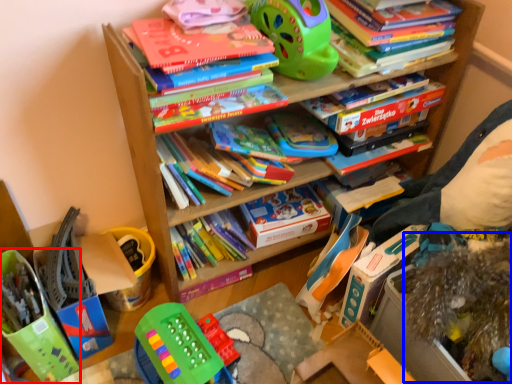
Question: Among these objects, which one is nearest to the camera, toy (highlighted by a red box) or toy (highlighted by a blue box)?

Choices:
 (A) toy
 (B) toy

Answer: (B)